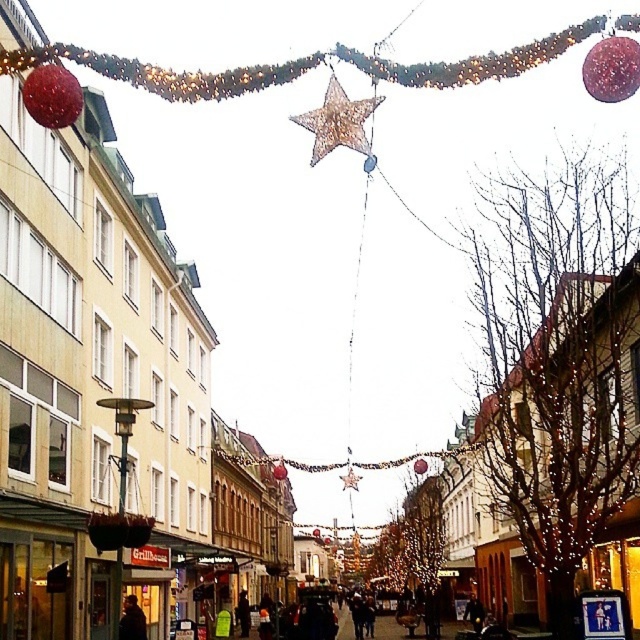
Question: Is glittery gold star at center bigger than metallic gold star at center?

Choices:
 (A) no
 (B) yes

Answer: (A)

Question: Which point is closer to the camera?

Choices:
 (A) metallic gold star at center
 (B) glittery gold star at center

Answer: (B)

Question: Which object appears closest to the camera in this image?

Choices:
 (A) metallic gold star at center
 (B) glittery gold star at center

Answer: (B)

Question: Is glittery gold star at center behind metallic gold star at center?

Choices:
 (A) yes
 (B) no

Answer: (B)

Question: Which of the following is the closest to the observer?

Choices:
 (A) glittery gold star at center
 (B) metallic gold star at center

Answer: (A)

Question: Can you confirm if glittery gold star at center is thinner than metallic gold star at center?

Choices:
 (A) yes
 (B) no

Answer: (A)